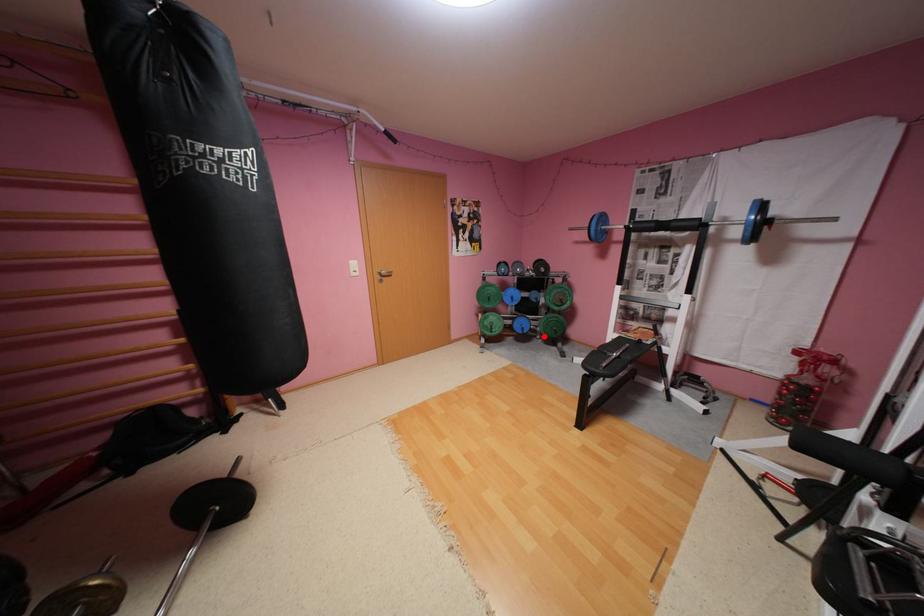
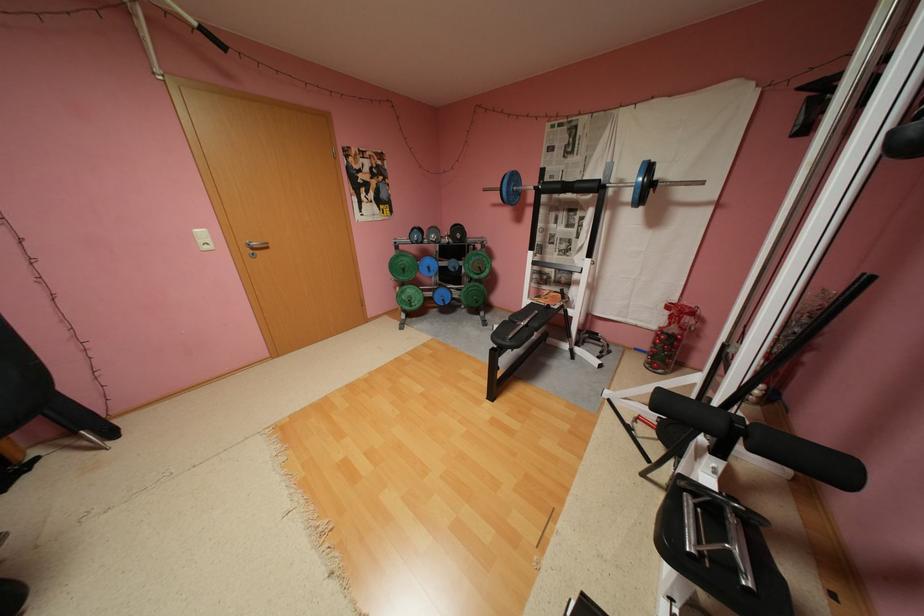
Question: I am providing you with two images of the same scene from different viewpoints. A red point is marked on the first image. Is the red point's position out of view in image 2?

Choices:
 (A) Yes
 (B) No

Answer: (B)